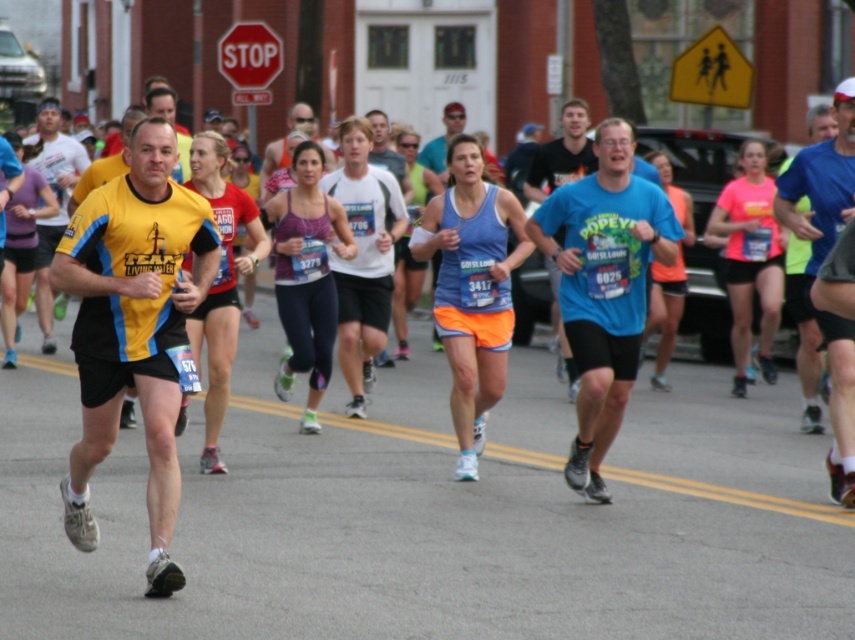
Question: Can you confirm if blue t-shirt at center is positioned above yellow fabric shirt at left?

Choices:
 (A) no
 (B) yes

Answer: (A)

Question: Which of the following is the closest to the observer?

Choices:
 (A) (743, 364)
 (B) (610, 285)

Answer: (B)

Question: Is pink fabric tank top at center further to the viewer compared to yellow fabric shirt at left?

Choices:
 (A) no
 (B) yes

Answer: (A)

Question: Which object appears farthest from the camera in this image?

Choices:
 (A) blue fabric shirt at center
 (B) yellow fabric shirt at center
 (C) blue t-shirt at center

Answer: (C)

Question: Which object appears closest to the camera in this image?

Choices:
 (A) yellow fabric shirt at left
 (B) yellow fabric shirt at center

Answer: (B)

Question: Does yellow fabric shirt at center have a greater width compared to yellow fabric shirt at left?

Choices:
 (A) no
 (B) yes

Answer: (A)